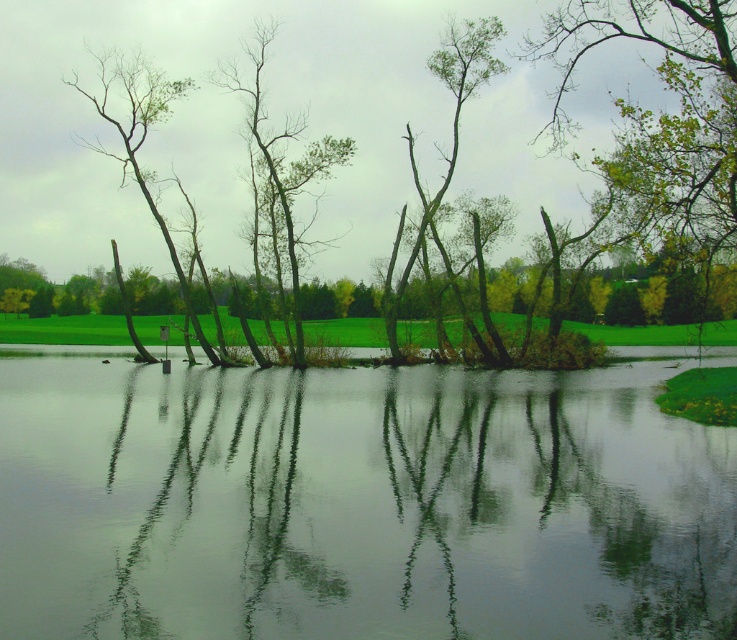
You are a GUI agent. You are given a task and a screenshot of the screen. Output one action in this format:
    pyautogui.click(x=<x>, y=<y>)
    Task: Click on the transparent water at center
    This screenshot has height=640, width=737.
    Given the screenshot: What is the action you would take?
    pyautogui.click(x=357, y=502)

Does transparent water at center appear over green leafy tree at center?

Actually, transparent water at center is below green leafy tree at center.

Does point (346, 604) come in front of point (430, 64)?

That is True.

Where is `transparent water at center`? transparent water at center is located at coordinates (357, 502).

Is transparent water at center above green leafy tree at upper right?

Incorrect, transparent water at center is not positioned above green leafy tree at upper right.

Can you confirm if transparent water at center is bigger than green leafy tree at upper right?

No, transparent water at center is not bigger than green leafy tree at upper right.

Measure the distance between transparent water at center and camera.

They are 29.26 feet apart.

Locate an element on the screen. transparent water at center is located at coordinates (357, 502).

Which is below, green leafy tree at center or bare wood tree at left?

green leafy tree at center

The height and width of the screenshot is (640, 737). Identify the location of green leafy tree at center. (453, 138).

Where is `green leafy tree at center`? This screenshot has width=737, height=640. green leafy tree at center is located at coordinates (453, 138).